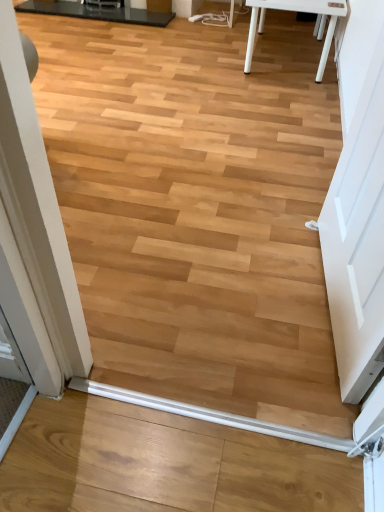
You are a GUI agent. You are given a task and a screenshot of the screen. Output one action in this format:
    pyautogui.click(x=<x>, y=<y>)
    Task: Click on the free space behind white matte door at right
    Image resolution: width=384 pixels, height=512 pixels.
    Given the screenshot: What is the action you would take?
    pyautogui.click(x=275, y=207)